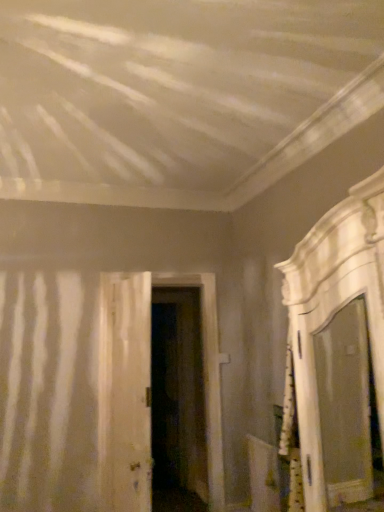
Question: In which direction should I rotate to look at white wood door at center, marked as the 1th door in a front-to-back arrangement?

Choices:
 (A) right
 (B) left

Answer: (B)

Question: Does white wood door at center, arranged as the third door when viewed from the back, have a greater width compared to white wood door at center, which ranks as the 2th door in front-to-back order?

Choices:
 (A) no
 (B) yes

Answer: (A)

Question: Is white wood door at center, arranged as the third door when viewed from the back, smaller than white wood door at center, which ranks as the 2th door in front-to-back order?

Choices:
 (A) yes
 (B) no

Answer: (A)

Question: Is there a large distance between white wood door at center, arranged as the third door when viewed from the back, and white wood door at center, which is the second door from back to front?

Choices:
 (A) no
 (B) yes

Answer: (A)

Question: Would you say white wood door at center, which is the second door from back to front, is part of white wood door at center, marked as the 1th door in a front-to-back arrangement,'s contents?

Choices:
 (A) yes
 (B) no

Answer: (B)

Question: Is white wood door at center, marked as the 1th door in a front-to-back arrangement, in front of white wood door at center, which is the second door from back to front?

Choices:
 (A) yes
 (B) no

Answer: (A)

Question: Is white wood door at center, arranged as the third door when viewed from the back, turned away from white wood door at center, which ranks as the 2th door in front-to-back order?

Choices:
 (A) no
 (B) yes

Answer: (A)

Question: Is white wood door at center, marked as the 1th door in a front-to-back arrangement, positioned beyond the bounds of dark wood door at center, the third door from the front?

Choices:
 (A) no
 (B) yes

Answer: (B)

Question: Is white wood door at center, marked as the 1th door in a front-to-back arrangement, positioned behind dark wood door at center, placed as the first door when sorted from back to front?

Choices:
 (A) no
 (B) yes

Answer: (A)

Question: Is white wood door at center, arranged as the third door when viewed from the back, far away from dark wood door at center, the third door from the front?

Choices:
 (A) yes
 (B) no

Answer: (A)

Question: Is dark wood door at center, placed as the first door when sorted from back to front, a part of white wood door at center, marked as the 1th door in a front-to-back arrangement?

Choices:
 (A) no
 (B) yes

Answer: (A)

Question: From the image's perspective, is white wood door at center, marked as the 1th door in a front-to-back arrangement, under dark wood door at center, the third door from the front?

Choices:
 (A) yes
 (B) no

Answer: (B)

Question: Does white wood door at center, marked as the 1th door in a front-to-back arrangement, touch dark wood door at center, placed as the first door when sorted from back to front?

Choices:
 (A) yes
 (B) no

Answer: (B)

Question: From a real-world perspective, is white glossy mirror at right physically above white wood door at center, which ranks as the 2th door in front-to-back order?

Choices:
 (A) no
 (B) yes

Answer: (B)